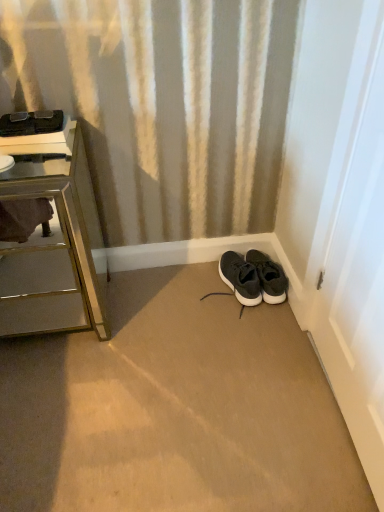
At what (x,y) coordinates should I click in order to perform the action: click on black matte sneakers at lower right. Please return your answer as a coordinate pair (x, y). This screenshot has height=512, width=384. Looking at the image, I should click on (269, 277).

Where is `black matte sneakers at lower right`? black matte sneakers at lower right is located at coordinates (269, 277).

Which of these two, black matte sneakers at lower right or metallic mirrored chest of drawers at left, is bigger?

Bigger between the two is metallic mirrored chest of drawers at left.

Is black matte sneakers at lower right facing away from metallic mirrored chest of drawers at left?

black matte sneakers at lower right does not have its back to metallic mirrored chest of drawers at left.

From a real-world perspective, is black matte sneakers at lower right above or below metallic mirrored chest of drawers at left?

In terms of real-world spatial position, black matte sneakers at lower right is below metallic mirrored chest of drawers at left.

Considering the positions of objects metallic mirrored chest of drawers at left and black matte sneakers at lower right in the image provided, who is in front, metallic mirrored chest of drawers at left or black matte sneakers at lower right?

metallic mirrored chest of drawers at left is in front.

Can you tell me how much metallic mirrored chest of drawers at left and black matte sneakers at lower right differ in facing direction?

The angular difference between metallic mirrored chest of drawers at left and black matte sneakers at lower right is 10.8 degrees.

Looking at this image, which of these two, metallic mirrored chest of drawers at left or black matte sneakers at lower right, is thinner?

With smaller width is black matte sneakers at lower right.

From a real-world perspective, is metallic mirrored chest of drawers at left on top of black matte sneakers at lower right?

Yes, from a real-world perspective, metallic mirrored chest of drawers at left is on top of black matte sneakers at lower right.

Does white glossy door at right lie in front of matte black sneaker at lower right?

Yes, it is.

Considering the positions of point (373, 261) and point (250, 282), is point (373, 261) closer or farther from the camera than point (250, 282)?

Clearly, point (373, 261) is closer to the camera than point (250, 282).

Does white glossy door at right contain matte black sneaker at lower right?

That's incorrect, matte black sneaker at lower right is not inside white glossy door at right.

From a real-world perspective, between metallic mirrored chest of drawers at left and white glossy door at right, who is vertically higher?

white glossy door at right.

Which is closer to the camera, (60, 298) or (341, 82)?

Point (60, 298).

Does metallic mirrored chest of drawers at left come behind white glossy door at right?

Yes, metallic mirrored chest of drawers at left is further from the viewer.

Are metallic mirrored chest of drawers at left and white glossy door at right beside each other?

No, metallic mirrored chest of drawers at left is not beside white glossy door at right.

Which point is more distant from viewer, (253, 302) or (246, 255)?

Point (246, 255)

Is matte black sneaker at lower right outside of black matte sneakers at lower right?

Yes.

Looking at the image, does matte black sneaker at lower right seem bigger or smaller compared to black matte sneakers at lower right?

In the image, matte black sneaker at lower right appears to be larger than black matte sneakers at lower right.

Locate an element on the screen. footwear to the right of matte black sneaker at lower right is located at coordinates (269, 277).

Is matte black sneaker at lower right facing towards white glossy door at right?

Yes, matte black sneaker at lower right is turned towards white glossy door at right.

In the image, is matte black sneaker at lower right positioned in front of or behind white glossy door at right?

Clearly, matte black sneaker at lower right is behind white glossy door at right.

From the image's perspective, who appears lower, matte black sneaker at lower right or white glossy door at right?

matte black sneaker at lower right.

Can you tell me how much matte black sneaker at lower right and white glossy door at right differ in facing direction?

The angular difference between matte black sneaker at lower right and white glossy door at right is 101 degrees.

Is black matte sneakers at lower right next to white glossy door at right and touching it?

No, black matte sneakers at lower right is not in contact with white glossy door at right.

From a real-world perspective, which object stands above the other?

white glossy door at right.

Measure the distance from black matte sneakers at lower right to white glossy door at right.

black matte sneakers at lower right is 48.02 centimeters from white glossy door at right.

Between black matte sneakers at lower right and white glossy door at right, which one appears on the left side from the viewer's perspective?

From the viewer's perspective, black matte sneakers at lower right appears more on the left side.

Where is `footwear below the metallic mirrored chest of drawers at left (from the image's perspective)`? The image size is (384, 512). footwear below the metallic mirrored chest of drawers at left (from the image's perspective) is located at coordinates (269, 277).

This screenshot has width=384, height=512. What are the coordinates of `footwear below the metallic mirrored chest of drawers at left (from a real-world perspective)` in the screenshot? It's located at (269, 277).

From the image, which object appears to be farther from matte black sneaker at lower right, white glossy door at right or black matte sneakers at lower right?

Based on the image, white glossy door at right appears to be further to matte black sneaker at lower right.

Considering their positions, is metallic mirrored chest of drawers at left positioned further to black matte sneakers at lower right than white glossy door at right?

metallic mirrored chest of drawers at left is further to black matte sneakers at lower right.

When comparing their distances from matte black sneaker at lower right, does black matte sneakers at lower right or metallic mirrored chest of drawers at left seem closer?

black matte sneakers at lower right is positioned closer to the anchor matte black sneaker at lower right.

Based on their spatial positions, is black matte sneakers at lower right or matte black sneaker at lower right further from metallic mirrored chest of drawers at left?

Based on the image, black matte sneakers at lower right appears to be further to metallic mirrored chest of drawers at left.

Based on their spatial positions, is metallic mirrored chest of drawers at left or white glossy door at right further from matte black sneaker at lower right?

metallic mirrored chest of drawers at left lies further to matte black sneaker at lower right than the other object.

Which object lies nearer to the anchor point black matte sneakers at lower right, white glossy door at right or matte black sneaker at lower right?

matte black sneaker at lower right.

From the image, which object appears to be farther from white glossy door at right, black matte sneakers at lower right or matte black sneaker at lower right?

matte black sneaker at lower right is positioned further to the anchor white glossy door at right.

Based on the photo, which object lies nearer to the anchor point white glossy door at right, matte black sneaker at lower right or black matte sneakers at lower right?

black matte sneakers at lower right.

Locate an element on the screen. Image resolution: width=384 pixels, height=512 pixels. the chest of drawers positioned between white glossy door at right and matte black sneaker at lower right from near to far is located at coordinates (54, 244).

The image size is (384, 512). Identify the location of shoe between white glossy door at right and black matte sneakers at lower right in the front-back direction. (240, 278).

Identify the location of shoe situated between metallic mirrored chest of drawers at left and black matte sneakers at lower right from left to right. (240, 278).

The width and height of the screenshot is (384, 512). Identify the location of chest of drawers between white glossy door at right and black matte sneakers at lower right from front to back. (54, 244).